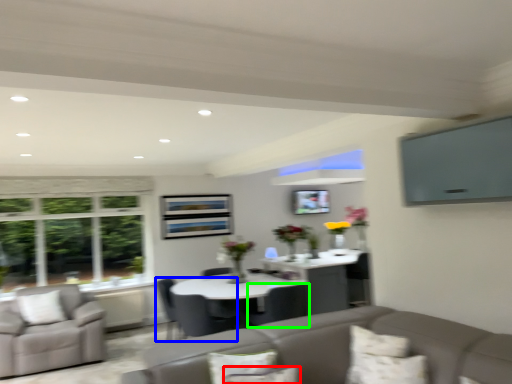
Question: Which object is the farthest from pillow (highlighted by a red box)? Choose among these: chair (highlighted by a blue box) or chair (highlighted by a green box).

Choices:
 (A) chair
 (B) chair

Answer: (A)